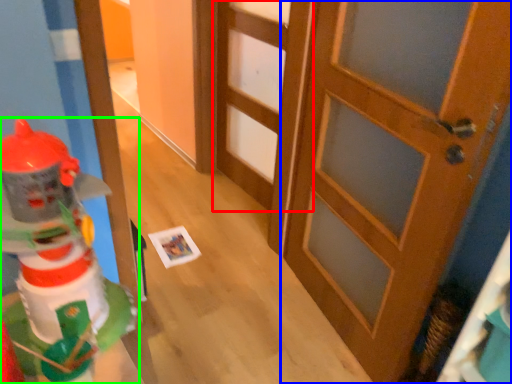
Question: Estimate the real-world distances between objects in this image. Which object is closer to door (highlighted by a red box), door (highlighted by a blue box) or toy (highlighted by a green box)?

Choices:
 (A) door
 (B) toy

Answer: (A)